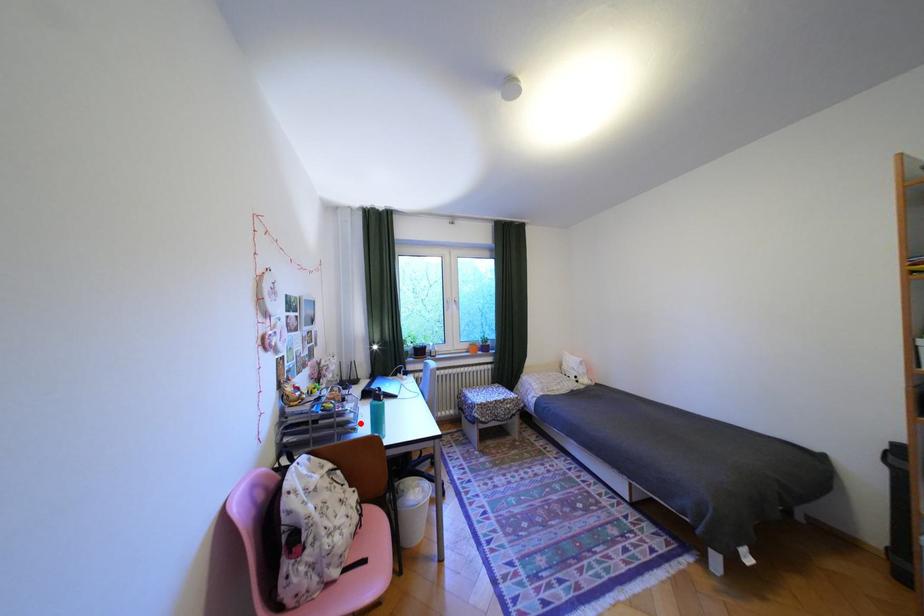
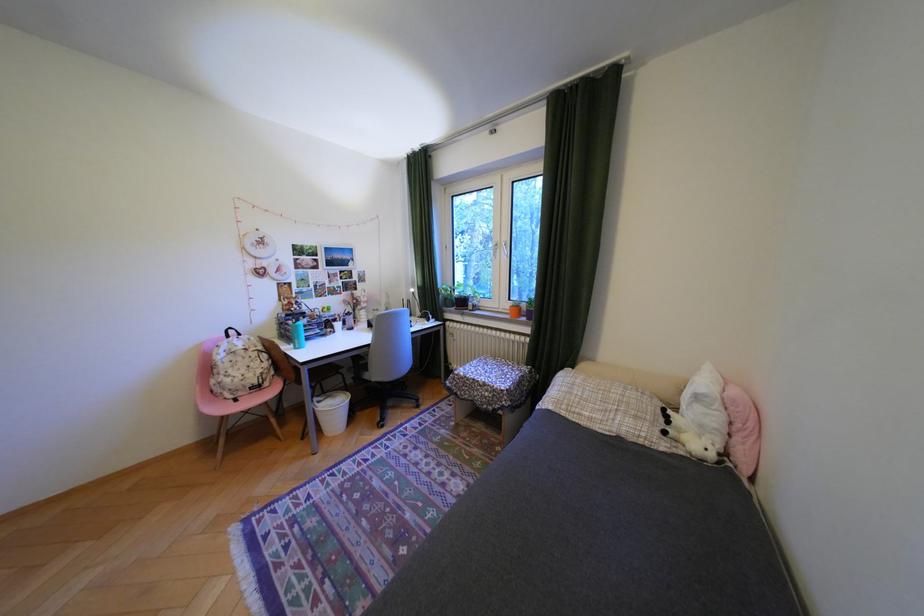
Find the pixel in the second image that matches the highlighted location in the first image.

(300, 331)